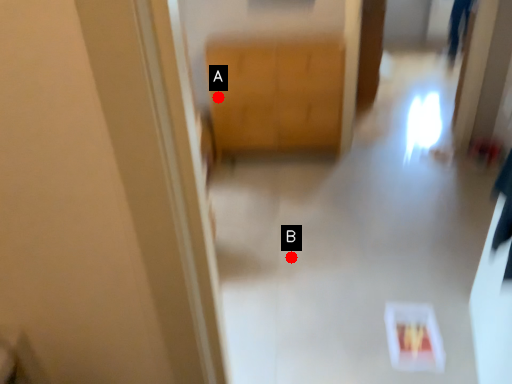
Question: Two points are circled on the image, labeled by A and B beside each circle. Among these points, which one is farthest from the camera?

Choices:
 (A) A is further
 (B) B is further

Answer: (A)